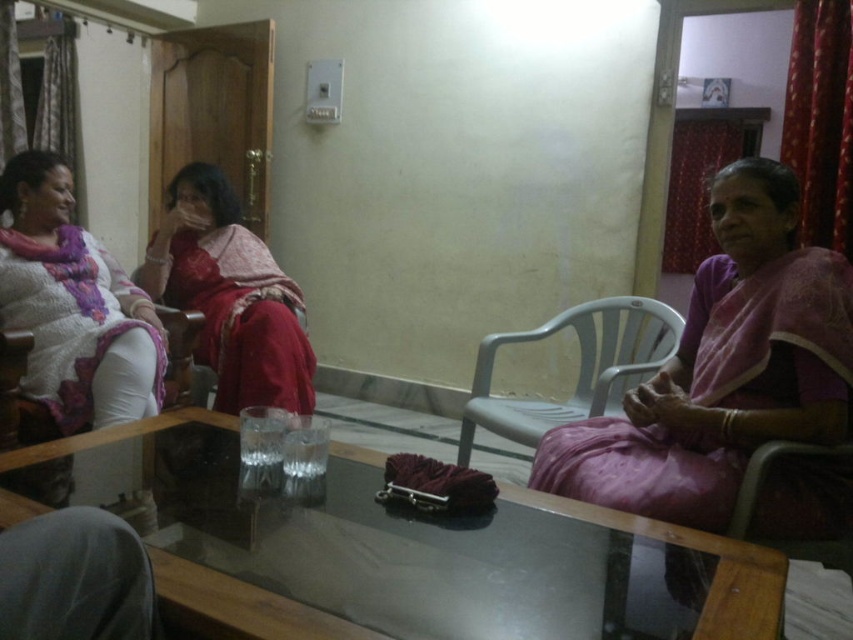
You are a photographer setting up a shoot in this living room. You need to ensure that the purple silk saree at right and the matte white pants at left are both visible in the frame. Based on their positions, which object is closer to the camera?

The purple silk saree at right is positioned under the matte white pants at left, meaning it is closer to the camera since it is in front of the other object.

You are standing in the living room and want to place a decorative vase on the transparent glass table at center. However, there is a purple silk saree at right nearby. Which direction should you move to reach the table from the saree?

The transparent glass table at center is to the left of the purple silk saree at right. Therefore, you should move to the left from the purple silk saree at right to reach the table.